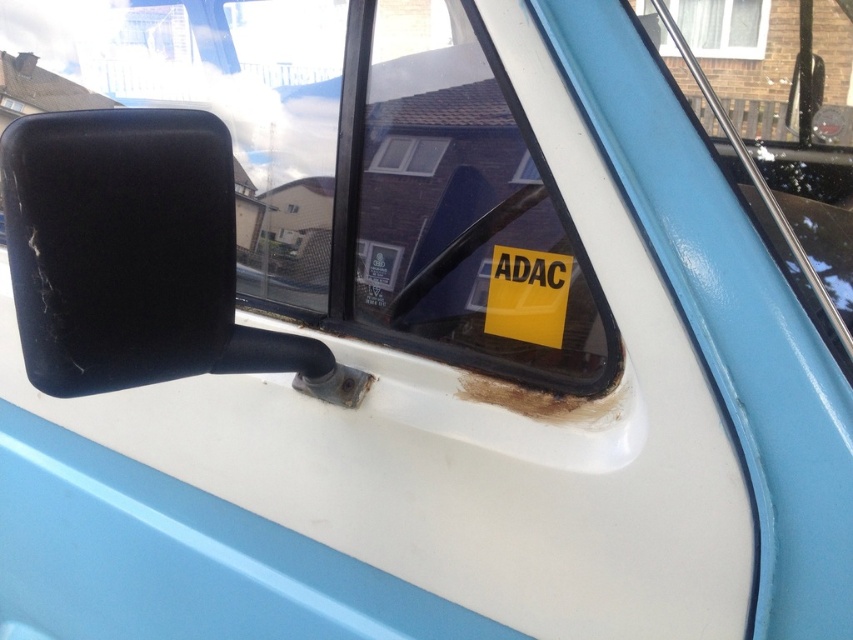
You are a car mechanic checking the distance between the transparent glass windshield at center and the matte black mirror at left. According to the manufacturer, the recommended distance between these two components should be at least 5 inches. Is the current distance compliant with the manufacturer recommendation?

The transparent glass windshield at center and matte black mirror at left are 4.62 inches apart, which is less than the recommended 5 inches. Therefore, the current distance does not comply with the manufacturer recommendation.

You are a passenger in the car and want to see the ADAC sticker on the clear glass window at upper center. Since the transparent glass windshield at center is blocking your view, can you move your head to the side to see it?

The transparent glass windshield at center is in front of clear glass window at upper center, so moving your head to the side might allow you to see around the windshield and view the ADAC sticker on the clear glass window at upper center.

You are standing 25 inches away from a matte black mirror at left. Can you reach it without moving your feet?

The matte black mirror at left is 26.21 inches away from viewer, so you are 1.21 inches too far to reach it without moving your feet.